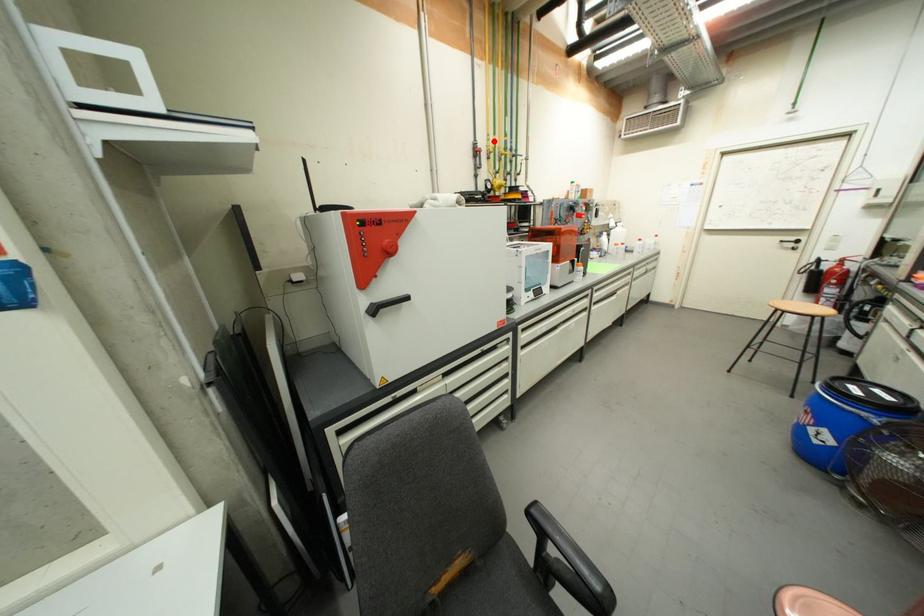
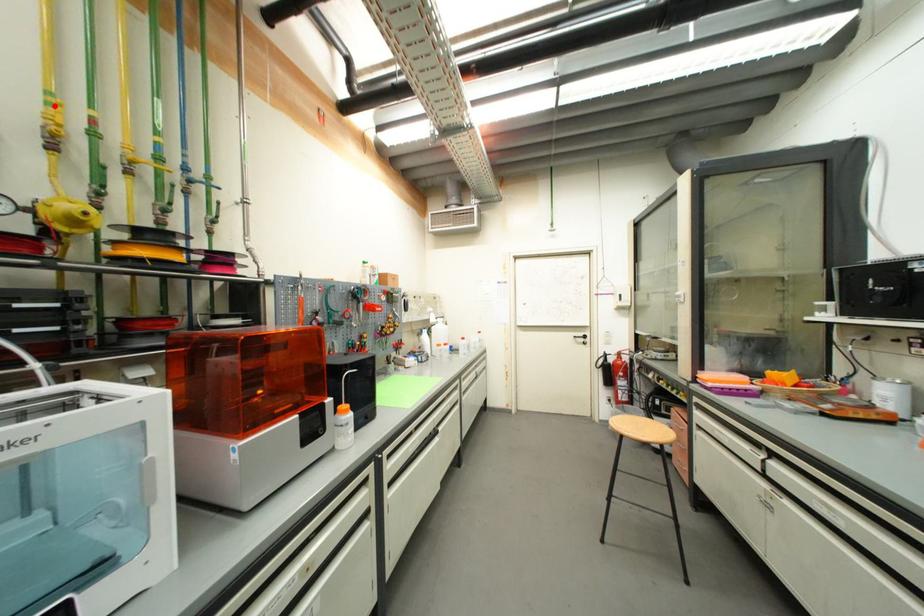
I am providing you with two images of the same scene from different viewpoints. A red point is marked on the first image and another point is marked on the second image. Are the points marked in image1 and image2 representing the same 3D position?

Yes